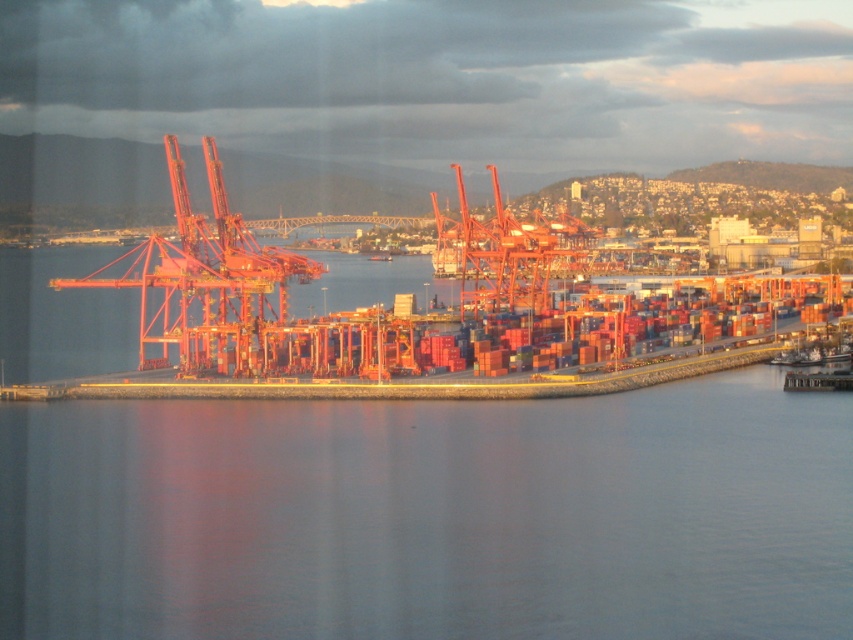
Who is taller, transparent water at lower center or metallic orange crane at center?

With more height is transparent water at lower center.

Is transparent water at lower center in front of metallic orange crane at center?

Yes, it is.

Describe the element at coordinates (432, 515) in the screenshot. This screenshot has height=640, width=853. I see `transparent water at lower center` at that location.

I want to click on transparent water at lower center, so point(432,515).